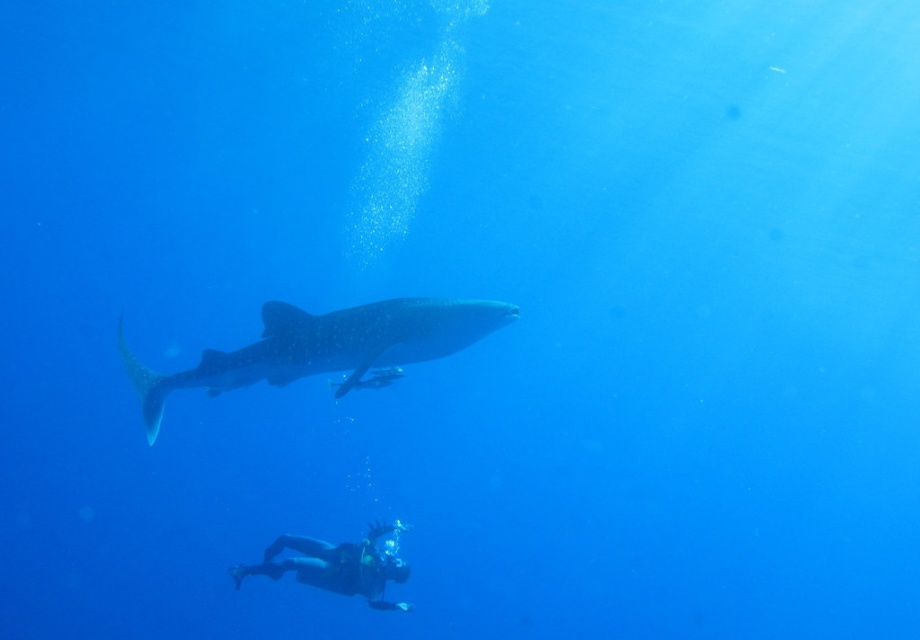
You are a marine biologist observing an underwater scene. You notice the speckled skin whale shark at center and the black scuba diver at lower center. Based on their positions, which object is above the other?

The speckled skin whale shark at center is positioned over the black scuba diver at lower center, so the whale shark is above the diver.

You are a marine biologist observing the underwater scene. You need to determine which object is bigger between the speckled skin whale shark at center and the black scuba diver at lower center. Based on the scene, which one is larger?

The speckled skin whale shark at center is larger in size than the black scuba diver at lower center according to the description.

You are a marine biologist analyzing the underwater scene. You need to determine if the speckled skin whale shark at center can fit through a narrow underwater cave entrance that is only as wide as the black scuba diver at lower center. Based on the image, what is your conclusion?

The speckled skin whale shark at center might be wider than the black scuba diver at lower center, so it may not fit through the cave entrance which is only as wide as the diver.